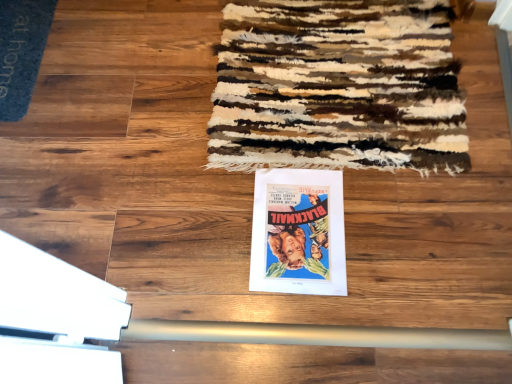
Where is `vacant space underneath matte paper poster at center (from a real-world perspective)`? vacant space underneath matte paper poster at center (from a real-world perspective) is located at coordinates (298, 226).